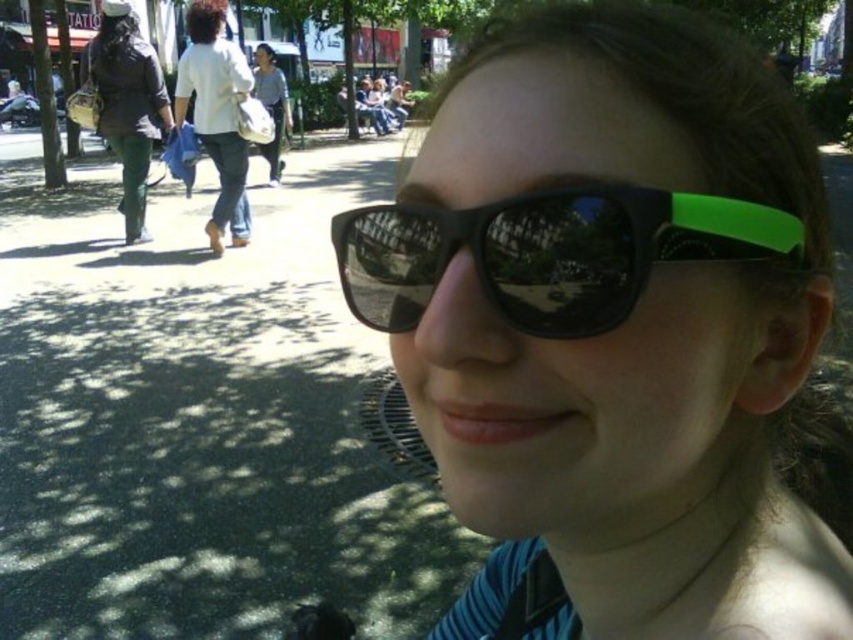
Question: Which of the following is the farthest from the observer?

Choices:
 (A) white cotton shirt at upper left
 (B) black matte sunglasses at center
 (C) matte black sunglasses at center
 (D) light blue shirt at center

Answer: (D)

Question: Is matte black sunglasses at center closer to camera compared to light blue shirt at center?

Choices:
 (A) yes
 (B) no

Answer: (A)

Question: Does black matte sunglasses at center appear on the right side of white cotton shirt at upper left?

Choices:
 (A) yes
 (B) no

Answer: (A)

Question: Is matte black sunglasses at center thinner than light blue shirt at center?

Choices:
 (A) no
 (B) yes

Answer: (B)

Question: Which point is farther to the camera?

Choices:
 (A) dark green pants at left
 (B) light blue shirt at center
 (C) black matte sunglasses at center

Answer: (B)

Question: Which point is farther to the camera?

Choices:
 (A) (224, 150)
 (B) (280, 118)

Answer: (B)